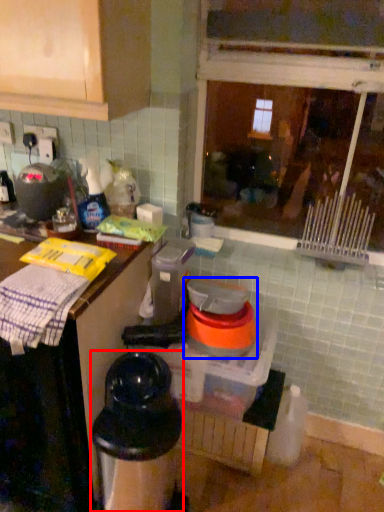
Question: Which object appears farthest to the camera in this image, appliance (highlighted by a red box) or appliance (highlighted by a blue box)?

Choices:
 (A) appliance
 (B) appliance

Answer: (B)